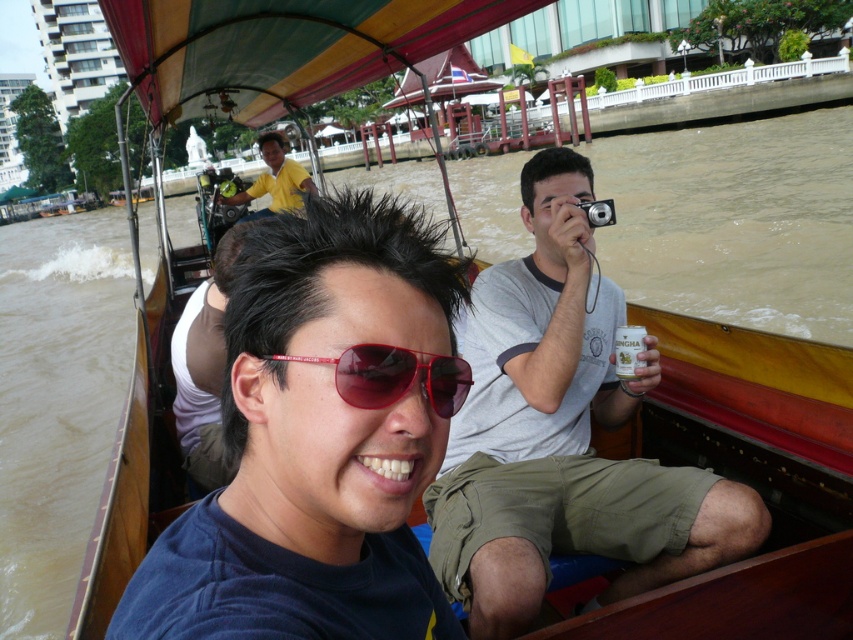
Question: Is red matte sunglasses at center above yellow shirt at center?

Choices:
 (A) yes
 (B) no

Answer: (B)

Question: Estimate the real-world distances between objects in this image. Which object is farther from the yellow shirt at center?

Choices:
 (A) gray cotton t-shirt at center
 (B) matte black sunglasses at center
 (C) red matte sunglasses at center

Answer: (C)

Question: Does matte black sunglasses at center come in front of yellow shirt at center?

Choices:
 (A) no
 (B) yes

Answer: (B)

Question: Which object is positioned farthest from the yellow shirt at center?

Choices:
 (A) matte black sunglasses at center
 (B) red matte sunglasses at center
 (C) gray cotton t-shirt at center

Answer: (B)

Question: Which is nearer to the yellow shirt at center?

Choices:
 (A) gray cotton t-shirt at center
 (B) matte black sunglasses at center

Answer: (A)

Question: Is gray cotton t-shirt at center smaller than red matte sunglasses at center?

Choices:
 (A) yes
 (B) no

Answer: (B)